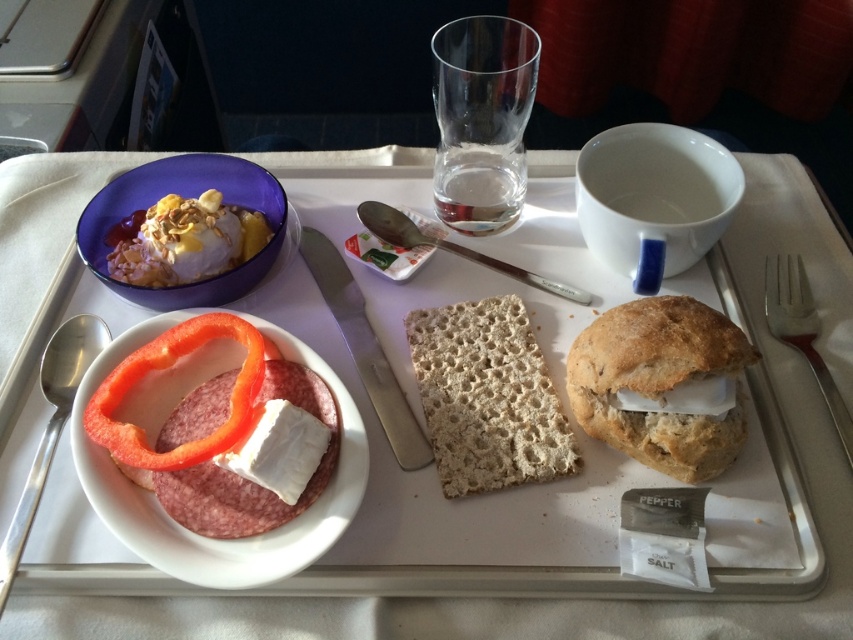
Does white crumbly bread at center have a greater height compared to bread at center?

Yes, white crumbly bread at center is taller than bread at center.

Is point (369, 580) positioned in front of point (497, 372)?

Yes, it is in front of point (497, 372).

What are the coordinates of `white crumbly bread at center` in the screenshot? It's located at (758, 410).

Find the location of a particular element. white crumbly bread at center is located at coordinates (758, 410).

Image resolution: width=853 pixels, height=640 pixels. I want to click on bread at center, so click(x=486, y=397).

Which is behind, point (520, 344) or point (113, 264)?

The point (113, 264) is more distant.

Find the location of a particular element. This screenshot has width=853, height=640. bread at center is located at coordinates (486, 397).

In the scene shown: Measure the distance between bread at center and camera.

bread at center and camera are 14.93 inches apart.

Can you confirm if bread at center is bigger than red smooth pepper at lower left?

Indeed, bread at center has a larger size compared to red smooth pepper at lower left.

You are a GUI agent. You are given a task and a screenshot of the screen. Output one action in this format:
    pyautogui.click(x=<x>, y=<y>)
    Task: Click on the bread at center
    Image resolution: width=853 pixels, height=640 pixels.
    Given the screenshot: What is the action you would take?
    pyautogui.click(x=486, y=397)

The height and width of the screenshot is (640, 853). In order to click on bread at center in this screenshot , I will do (x=486, y=397).